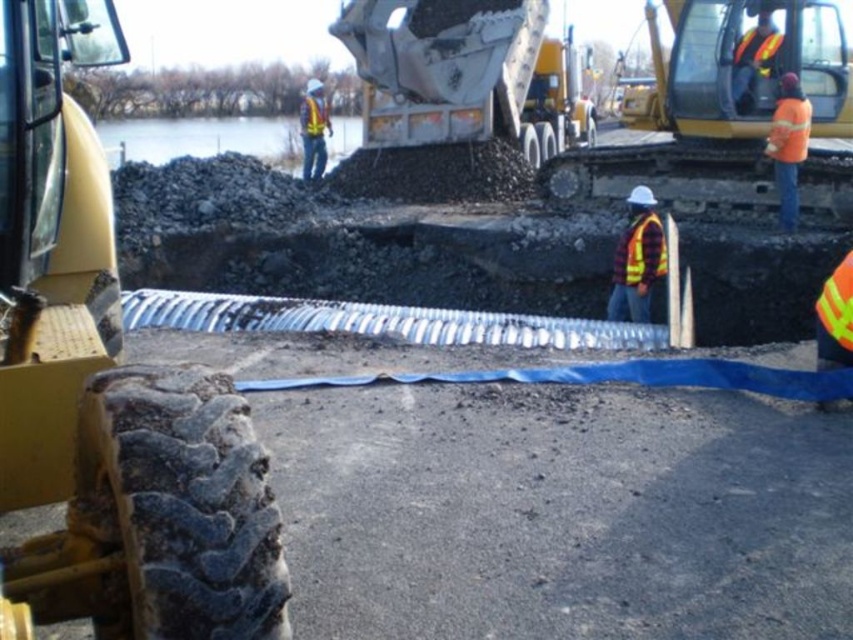
Question: Can you confirm if reflective mesh safety vest at center is positioned to the right of orange reflective safety vest at right?

Choices:
 (A) yes
 (B) no

Answer: (B)

Question: Based on their relative distances, which object is farther from the yellow reflective safety vest at center?

Choices:
 (A) yellow rubber track at upper right
 (B) orange reflective safety vest at upper right

Answer: (B)

Question: Is rubber tread at left to the right of yellow reflective safety vest at center from the viewer's perspective?

Choices:
 (A) yes
 (B) no

Answer: (A)

Question: Which point is closer to the camera?

Choices:
 (A) orange reflective safety vest at upper right
 (B) rubber tread at left
 (C) yellow rubber track at upper right

Answer: (B)

Question: Can you confirm if black gravel at center is smaller than orange reflective safety vest at right?

Choices:
 (A) no
 (B) yes

Answer: (A)

Question: Which object appears farthest from the camera in this image?

Choices:
 (A) reflective mesh safety vest at center
 (B) rubber tread at left
 (C) black gravel at center
 (D) yellow reflective safety vest at center

Answer: (D)